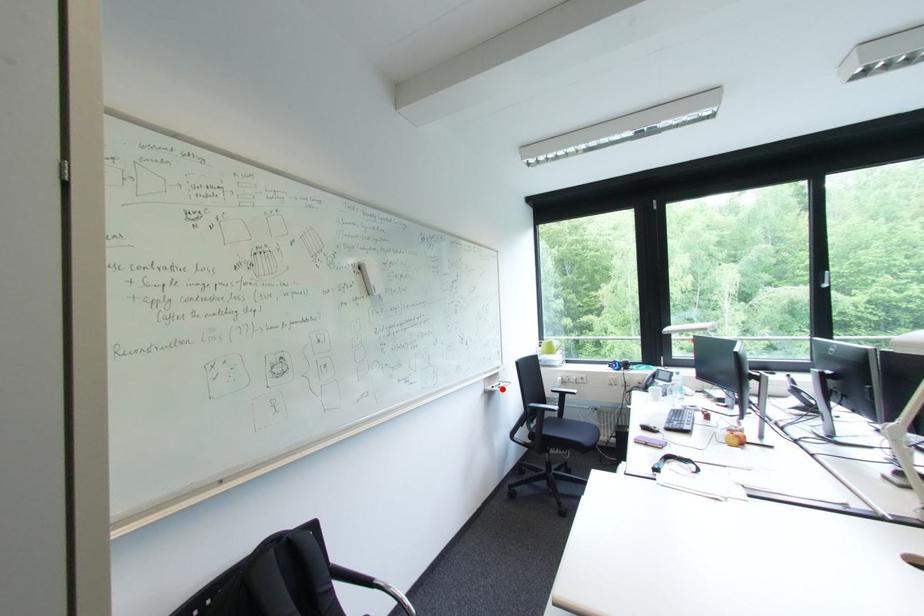
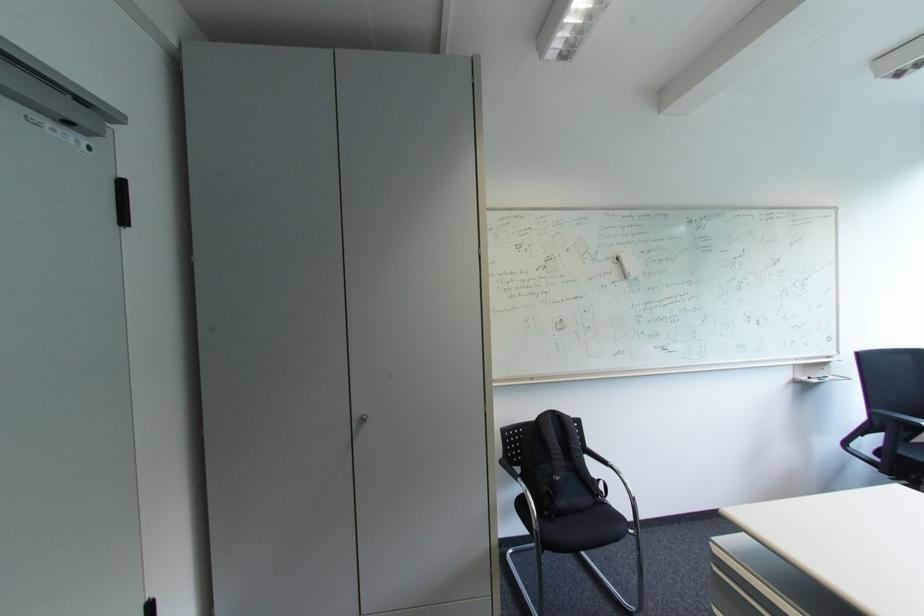
Question: I am providing you with two images of the same scene from different viewpoints. Image1 has a red point marked. In image2, the corresponding 3D location appears at what relative position? Reply with the corresponding letter.

Choices:
 (A) Closer
 (B) Farther

Answer: (A)